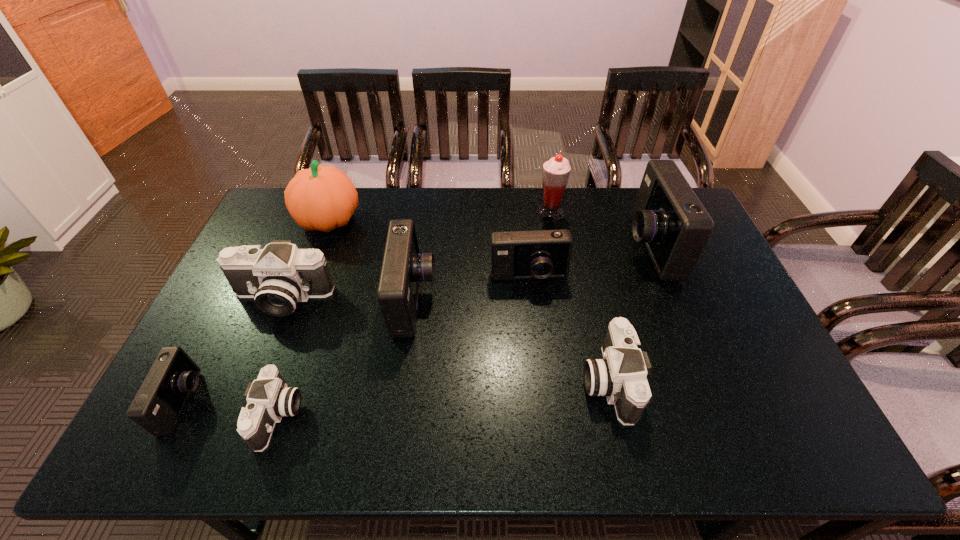
This screenshot has height=540, width=960. I want to click on red smoothie, so click(x=556, y=171).

Image resolution: width=960 pixels, height=540 pixels. I want to click on orange pumpkin, so click(321, 198).

What are the coordinates of `the tallest camera` in the screenshot? It's located at (669, 218).

Where is `the biggest blue camera`? The width and height of the screenshot is (960, 540). the biggest blue camera is located at coordinates (669, 218).

The image size is (960, 540). I want to click on the fourth camera from right to left, so click(x=403, y=268).

In order to click on the second blue camera from left to right in this screenshot , I will do `click(403, 268)`.

The width and height of the screenshot is (960, 540). In order to click on the biggest black camera in this screenshot , I will do `click(279, 276)`.

The image size is (960, 540). In order to click on the third biggest blue camera in this screenshot , I will do `click(538, 254)`.

Where is `the rightmost black camera`? The height and width of the screenshot is (540, 960). the rightmost black camera is located at coordinates (621, 376).

This screenshot has width=960, height=540. I want to click on the nearest blue camera, so click(x=159, y=402).